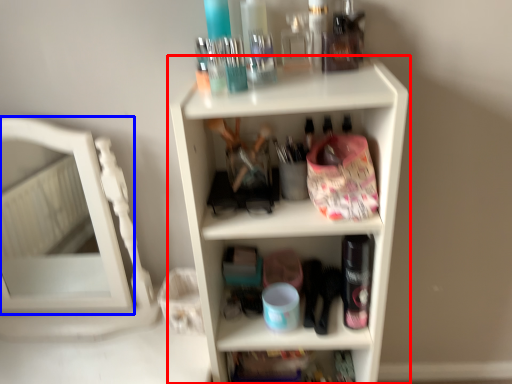
Question: Which object is further to the camera taking this photo, shelf (highlighted by a red box) or mirror (highlighted by a blue box)?

Choices:
 (A) shelf
 (B) mirror

Answer: (B)